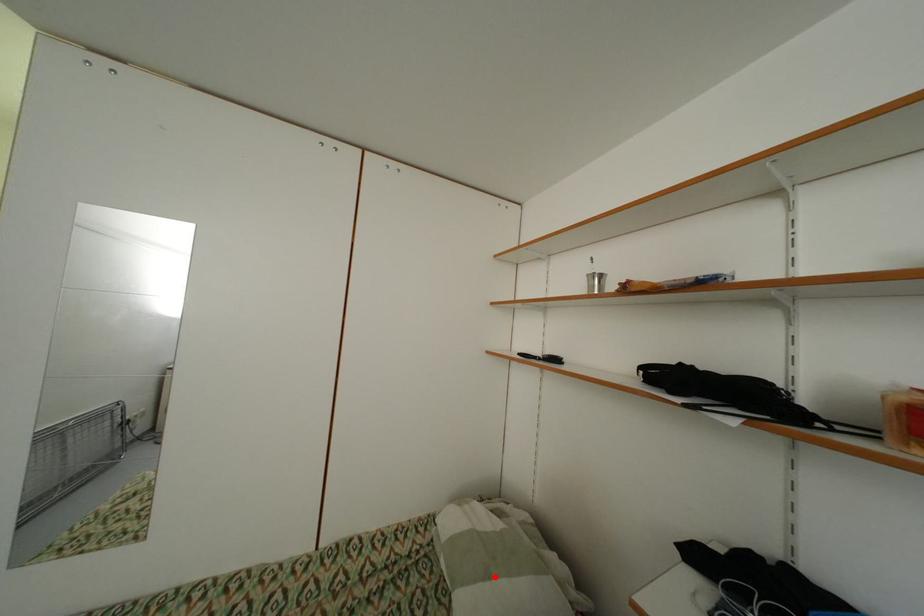
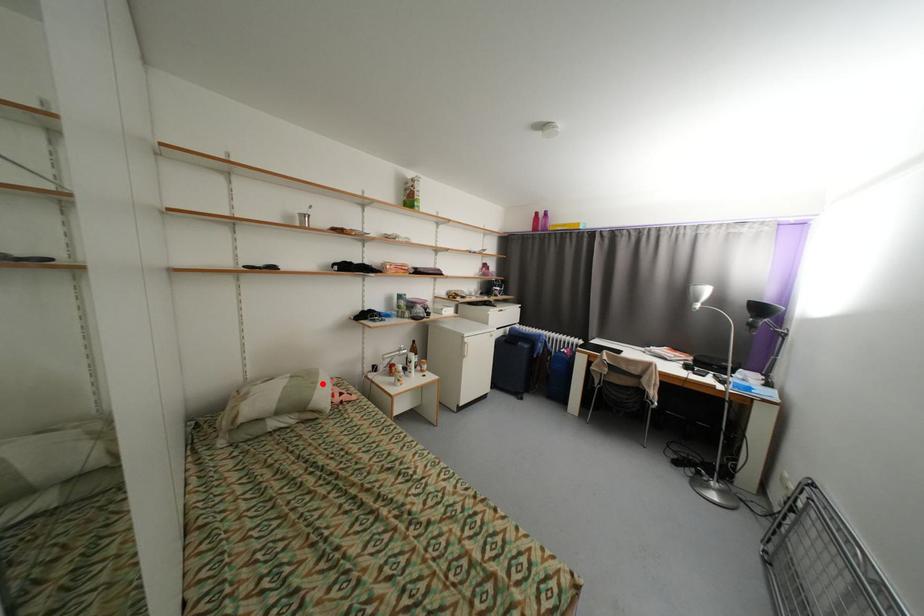
I am providing you with two images of the same scene from different viewpoints. A red point is marked on the first image and another point is marked on the second image. Is the marked point in image1 the same physical position as the marked point in image2?

Yes